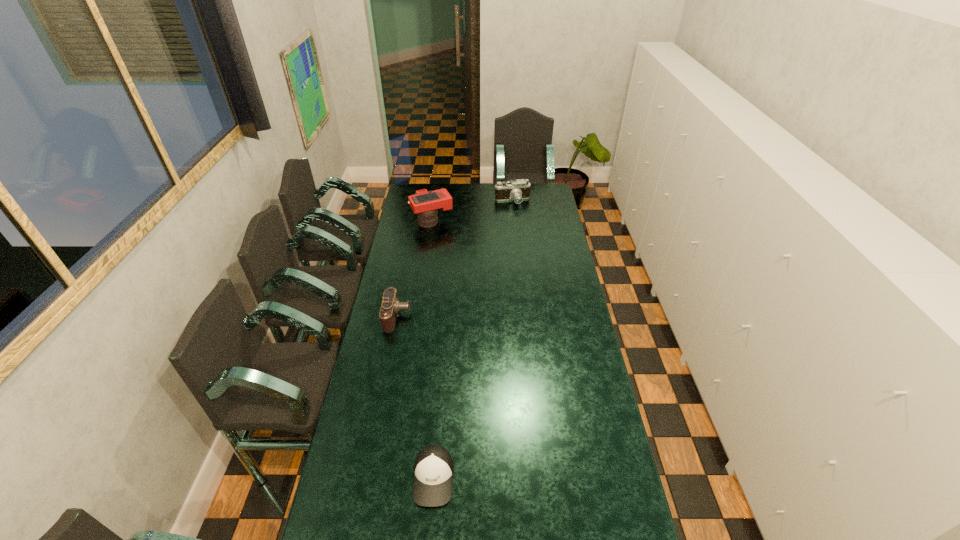
Where is `camera identified as the closest to the tallest object`? camera identified as the closest to the tallest object is located at coordinates (517, 190).

In order to click on camera object that ranks as the closest to the nearest camera in this screenshot , I will do `click(424, 203)`.